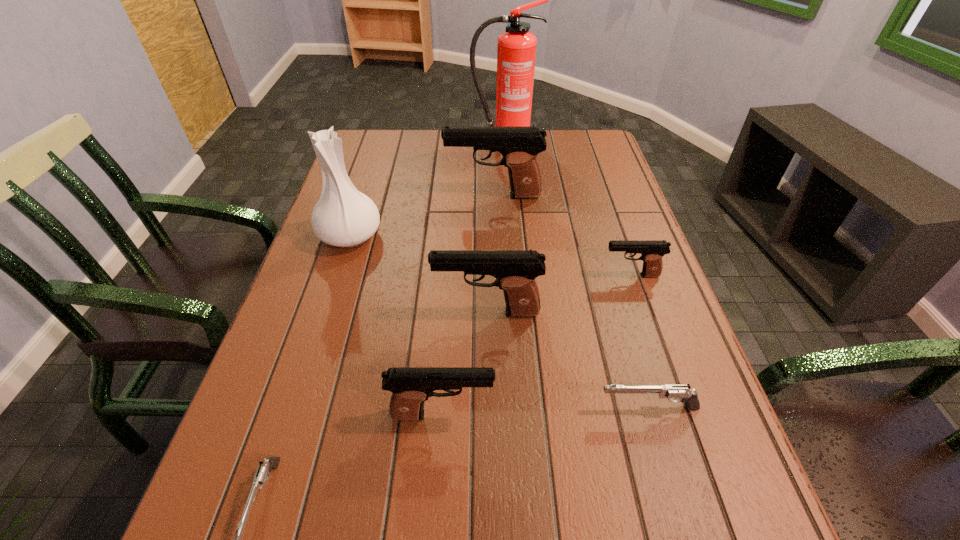
This screenshot has height=540, width=960. Find the location of `vacant space that's between the fire extinguisher and the tallest pistol`. vacant space that's between the fire extinguisher and the tallest pistol is located at coordinates (498, 167).

This screenshot has height=540, width=960. In order to click on empty location between the fourth shortest pistol and the fifth shortest pistol in this screenshot , I will do `click(465, 363)`.

I want to click on unoccupied position between the fire extinguisher and the fifth shortest object, so click(x=495, y=226).

This screenshot has width=960, height=540. In order to click on vacant space in between the sixth shortest object and the farther silver pistol in this screenshot , I will do `click(570, 302)`.

Locate an element on the screen. object that is the closest one to the white vase is located at coordinates (519, 146).

Find the location of a particular element. The width and height of the screenshot is (960, 540). the seventh closest object to the right silver pistol is located at coordinates (516, 52).

Identify which pistol is the closest to the second farthest black pistol. Please provide its 2D coordinates. Your answer should be formatted as a tuple, i.e. [(x, y)], where the tuple contains the x and y coordinates of a point satisfying the conditions above.

[(515, 271)]

Select which pistol is the fifth closest to the bigger silver pistol. Please provide its 2D coordinates. Your answer should be formatted as a tuple, i.e. [(x, y)], where the tuple contains the x and y coordinates of a point satisfying the conditions above.

[(519, 146)]

At what (x,y) coordinates should I click in order to perform the action: click on the third closest black pistol to the farthest black pistol. Please return your answer as a coordinate pair (x, y). The width and height of the screenshot is (960, 540). Looking at the image, I should click on (411, 386).

You are a GUI agent. You are given a task and a screenshot of the screen. Output one action in this format:
    pyautogui.click(x=<x>, y=<y>)
    Task: Click on the black pistol object that ranks as the third closest to the third biggest black pistol
    The width and height of the screenshot is (960, 540).
    Given the screenshot: What is the action you would take?
    pyautogui.click(x=519, y=146)